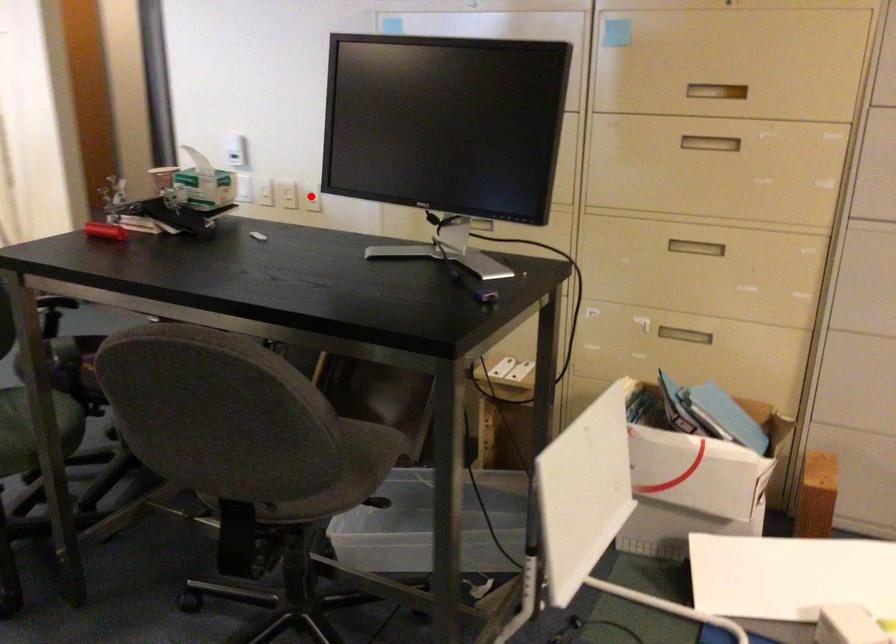
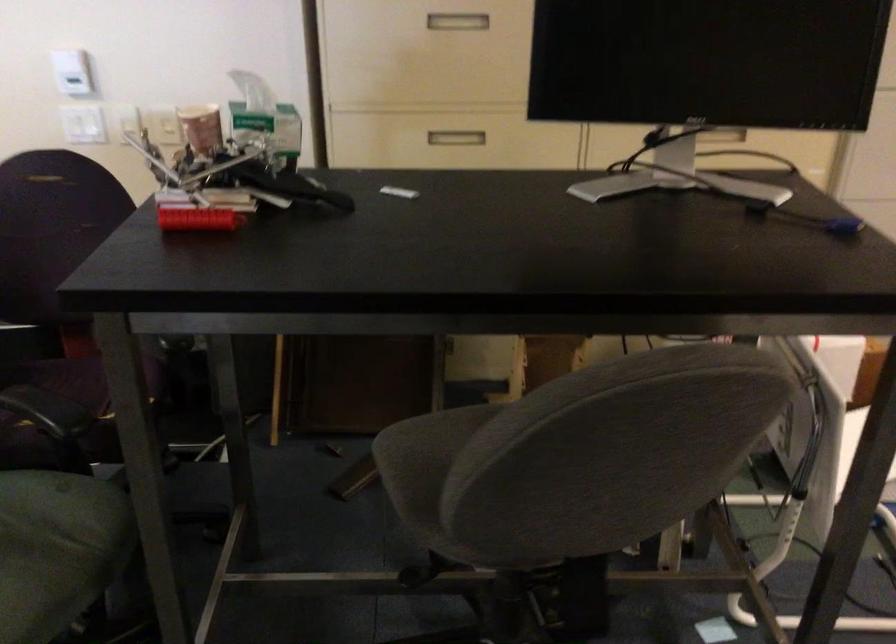
Question: I am providing you with two images of the same scene from different viewpoints. A red point is marked on the first image. Can you still see the location of the red point in image 2?

Choices:
 (A) Yes
 (B) No

Answer: (B)